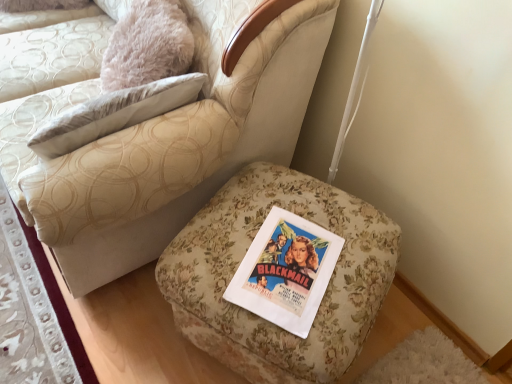
The height and width of the screenshot is (384, 512). I want to click on floral fabric ottoman at lower left, so click(x=33, y=312).

What do you see at coordinates (33, 312) in the screenshot? I see `floral fabric ottoman at lower left` at bounding box center [33, 312].

Find the location of a particular element. The image size is (512, 384). floral fabric ottoman at lower left is located at coordinates (33, 312).

Is floral fabric ottoman at lower left to the left or to the right of floral fabric ottoman at center in the image?

In the image, floral fabric ottoman at lower left appears on the left side of floral fabric ottoman at center.

From the image's perspective, which is above, floral fabric ottoman at lower left or floral fabric ottoman at center?

floral fabric ottoman at center.

Could floral fabric ottoman at center be considered to be inside floral fabric ottoman at lower left?

Definitely not — floral fabric ottoman at center is not inside floral fabric ottoman at lower left.

Based on the photo, from a real-world perspective, is floral fabric ottoman at lower left on top of floral fabric ottoman at center?

No, from a real-world perspective, floral fabric ottoman at lower left is not on top of floral fabric ottoman at center.

Is point (294, 370) closer or farther from the camera than point (267, 63)?

Point (294, 370) is closer to the camera than point (267, 63).

From the image's perspective, is floral fabric ottoman at lower right above or below floral fabric ottoman at center?

floral fabric ottoman at lower right is below floral fabric ottoman at center.

Is floral fabric ottoman at lower right outside of floral fabric ottoman at center?

That's correct, floral fabric ottoman at lower right is outside of floral fabric ottoman at center.

From a real-world perspective, is floral fabric ottoman at center positioned above or below floral fabric ottoman at lower left?

Clearly, from a real-world perspective, floral fabric ottoman at center is above floral fabric ottoman at lower left.

Considering the points (210, 154) and (5, 272), which point is in front, point (210, 154) or point (5, 272)?

Point (210, 154)

From the image's perspective, between floral fabric ottoman at center and floral fabric ottoman at lower left, who is located below?

floral fabric ottoman at lower left, from the image's perspective.

Is floral fabric ottoman at center turned away from floral fabric ottoman at lower left?

No, floral fabric ottoman at center is not facing the opposite direction of floral fabric ottoman at lower left.

Is point (59, 361) behind point (306, 176)?

No, (59, 361) is closer to viewer.

In the scene shown: Considering the relative sizes of floral fabric ottoman at lower left and floral fabric ottoman at lower right in the image provided, is floral fabric ottoman at lower left thinner than floral fabric ottoman at lower right?

Correct, the width of floral fabric ottoman at lower left is less than that of floral fabric ottoman at lower right.

How much distance is there between floral fabric ottoman at lower left and floral fabric ottoman at lower right?

They are 25.78 inches apart.

Is floral fabric ottoman at lower left positioned beyond the bounds of floral fabric ottoman at lower right?

Yes, floral fabric ottoman at lower left is not within floral fabric ottoman at lower right.

From a real-world perspective, who is located higher, floral fabric ottoman at center or floral fabric ottoman at lower right?

floral fabric ottoman at center, from a real-world perspective.

From the image's perspective, is floral fabric ottoman at center above or below floral fabric ottoman at lower right?

Clearly, from the image's perspective, floral fabric ottoman at center is above floral fabric ottoman at lower right.

Can you confirm if floral fabric ottoman at lower right is positioned to the right of floral fabric ottoman at lower left?

Correct, you'll find floral fabric ottoman at lower right to the right of floral fabric ottoman at lower left.

Would you say floral fabric ottoman at lower left is part of floral fabric ottoman at lower right's contents?

No, floral fabric ottoman at lower left is not surrounded by floral fabric ottoman at lower right.

Between floral fabric ottoman at lower right and floral fabric ottoman at lower left, which one has less height?

floral fabric ottoman at lower left is shorter.

From the image's perspective, who appears lower, floral fabric ottoman at lower right or floral fabric ottoman at lower left?

floral fabric ottoman at lower left is shown below in the image.

At what (x,y) coordinates should I click in order to perform the action: click on chair on the right of floral fabric ottoman at lower left. Please return your answer as a coordinate pair (x, y). The height and width of the screenshot is (384, 512). Looking at the image, I should click on (168, 145).

Find the location of a particular element. furniture located behind the floral fabric ottoman at center is located at coordinates (249, 245).

In the scene shown: Looking at the image, which one is located closer to floral fabric ottoman at lower right, floral fabric ottoman at lower left or floral fabric ottoman at center?

Based on the image, floral fabric ottoman at center appears to be nearer to floral fabric ottoman at lower right.

Looking at the image, which one is located further to floral fabric ottoman at center, floral fabric ottoman at lower left or floral fabric ottoman at lower right?

The object further to floral fabric ottoman at center is floral fabric ottoman at lower left.

Based on their spatial positions, is floral fabric ottoman at center or floral fabric ottoman at lower right closer to floral fabric ottoman at lower left?

floral fabric ottoman at center is positioned closer to the anchor floral fabric ottoman at lower left.

When comparing their distances from floral fabric ottoman at lower right, does floral fabric ottoman at center or floral fabric ottoman at lower left seem further?

floral fabric ottoman at lower left.

Looking at the image, which one is located closer to floral fabric ottoman at lower left, floral fabric ottoman at lower right or floral fabric ottoman at center?

Among the two, floral fabric ottoman at center is located nearer to floral fabric ottoman at lower left.

Estimate the real-world distances between objects in this image. Which object is closer to floral fabric ottoman at center, floral fabric ottoman at lower right or floral fabric ottoman at lower left?

The object closer to floral fabric ottoman at center is floral fabric ottoman at lower right.

I want to click on furniture between floral fabric ottoman at center and floral fabric ottoman at lower left vertically, so click(249, 245).